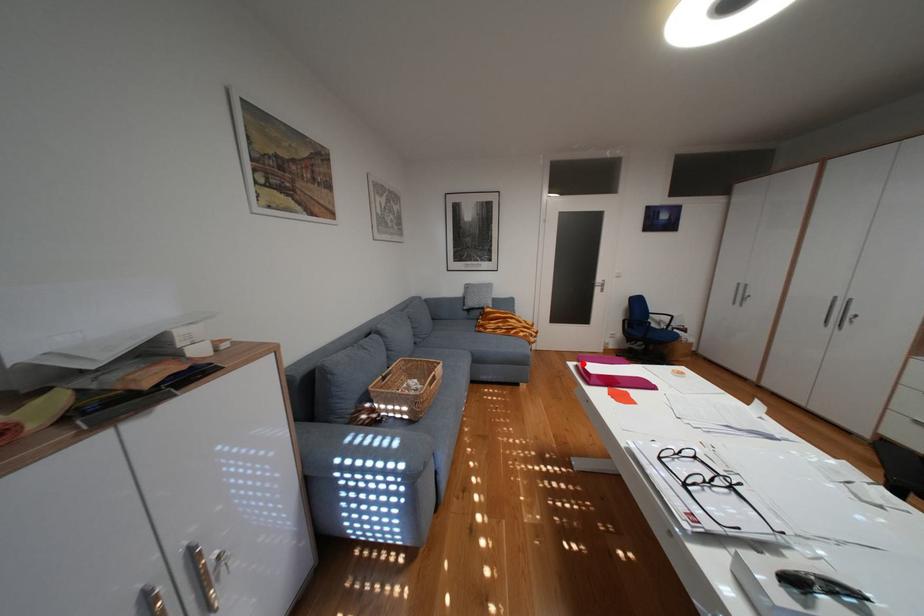
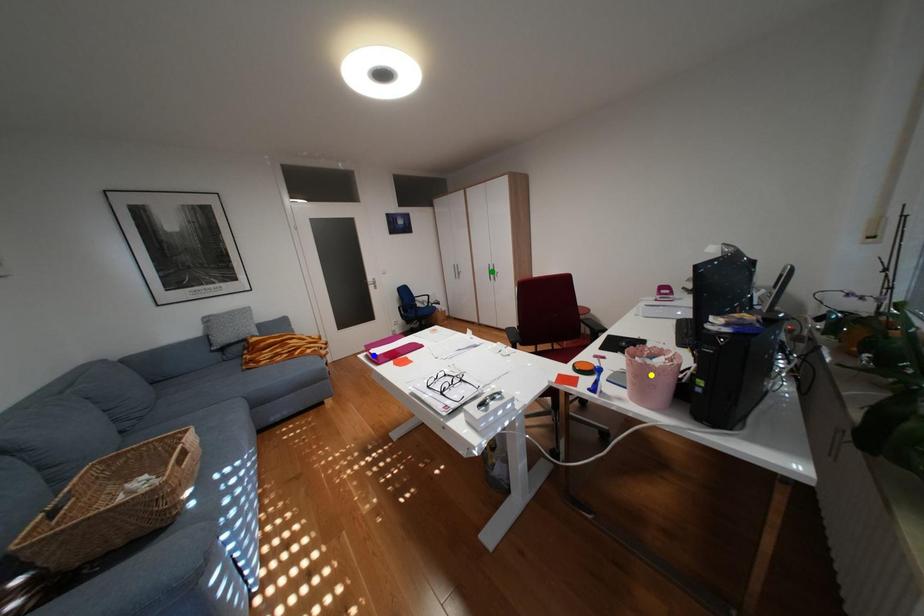
Question: I am providing you with two images of the same scene from different viewpoints. A red point is marked on the first image. You are given multiple points on the second image. Which mark in image 2 goes with the point in image 1?

Choices:
 (A) green point
 (B) blue point
 (C) yellow point

Answer: (B)